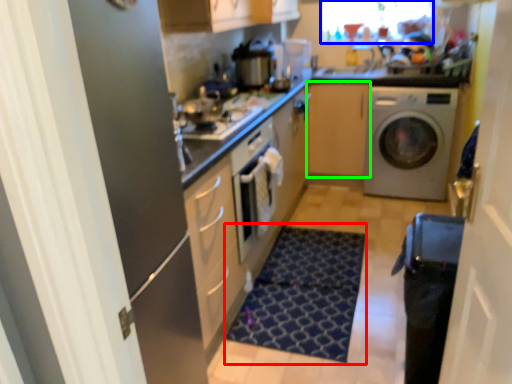
Question: Which is farther away from doormat (highlighted by a red box)? window screen (highlighted by a blue box) or cabinetry (highlighted by a green box)?

Choices:
 (A) window screen
 (B) cabinetry

Answer: (A)